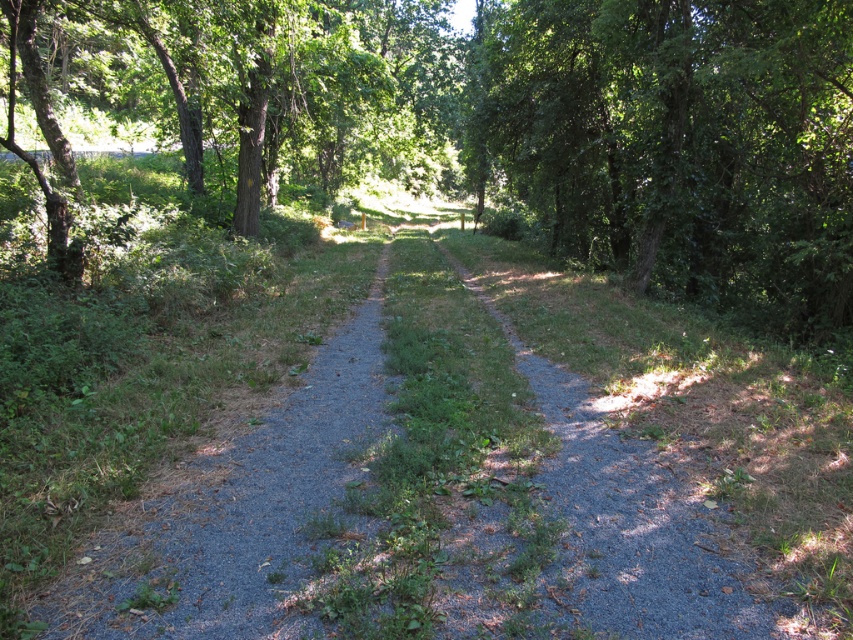
Is the position of gray gravel path at center more distant than that of green leafy tree at right?

No.

Looking at this image, can you confirm if gray gravel path at center is wider than green leafy tree at right?

Incorrect, gray gravel path at center's width does not surpass green leafy tree at right's.

What do you see at coordinates (426, 499) in the screenshot? I see `gray gravel path at center` at bounding box center [426, 499].

Locate an element on the screen. The height and width of the screenshot is (640, 853). gray gravel path at center is located at coordinates (426, 499).

Does green leafy tree at center have a larger size compared to gray gravel path at center?

Indeed, green leafy tree at center has a larger size compared to gray gravel path at center.

Is green leafy tree at center positioned at the back of gray gravel path at center?

Yes, green leafy tree at center is behind gray gravel path at center.

Is point (253, 116) closer to camera compared to point (717, 561)?

That is False.

The width and height of the screenshot is (853, 640). Find the location of `green leafy tree at center`. green leafy tree at center is located at coordinates (497, 122).

Which is above, green leafy tree at center or green leafy tree at right?

Positioned higher is green leafy tree at center.

Which is in front, point (228, 80) or point (604, 140)?

Point (228, 80) is in front.

Where is `green leafy tree at center`? This screenshot has width=853, height=640. green leafy tree at center is located at coordinates (497, 122).